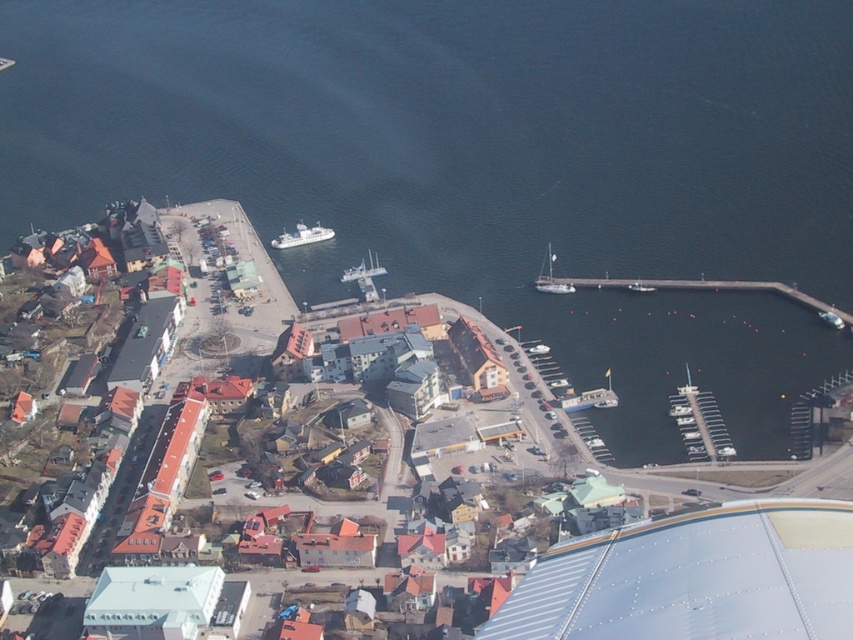
Consider the image. Is dark blue water at center in front of white plastic boat at center?

Yes.

Who is more distant from viewer, (322, 188) or (653, 289)?

The point (322, 188) is behind.

I want to click on dark blue water at center, so [485, 166].

Does white plastic boat at center have a smaller size compared to white glossy boat at center?

Yes.

Is point (635, 291) positioned behind point (531, 353)?

Yes, point (635, 291) is farther from viewer.

Between point (653, 291) and point (537, 346), which one is positioned in front?

Point (537, 346) is more forward.

Find the location of `white plastic boat at center`. white plastic boat at center is located at coordinates (641, 285).

Looking at this image, which of these two, dark blue water at center or white glossy boat at center, stands shorter?

Standing shorter between the two is white glossy boat at center.

In the scene shown: Is dark blue water at center smaller than white glossy boat at center?

Incorrect, dark blue water at center is not smaller in size than white glossy boat at center.

Where is `dark blue water at center`? dark blue water at center is located at coordinates (485, 166).